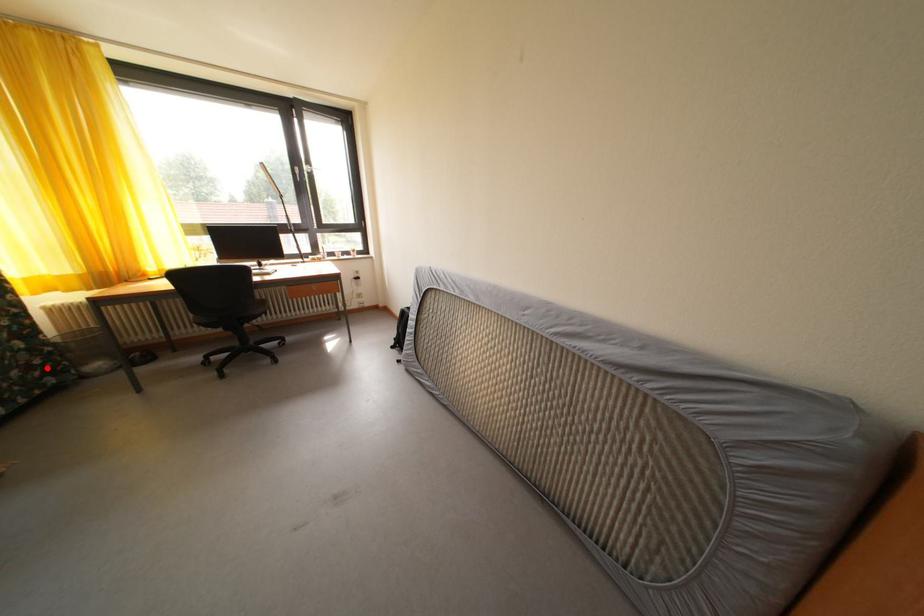
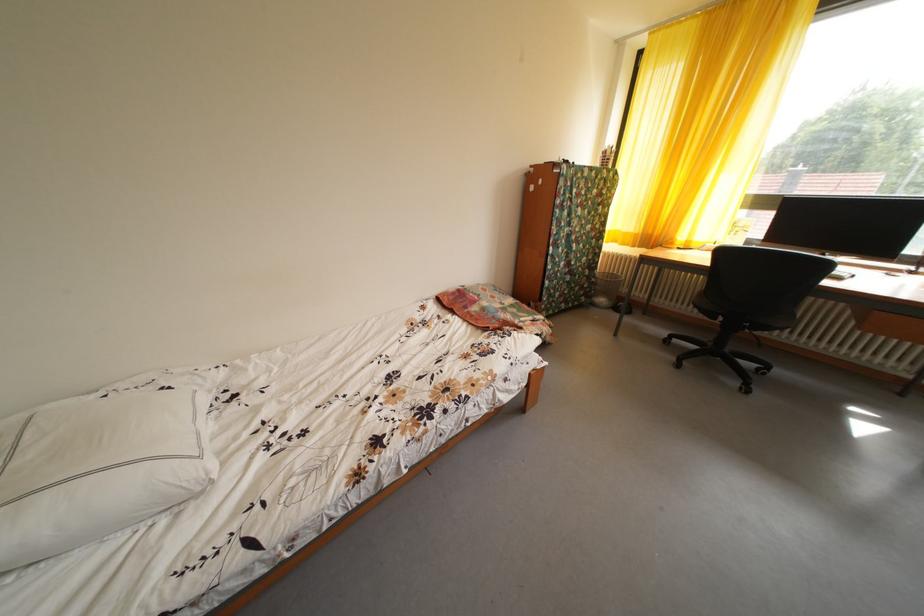
Question: I am providing you with two images of the same scene from different viewpoints. Image1 has a red point marked. In image2, the corresponding 3D location appears at what relative position? Reply with the corresponding letter.

Choices:
 (A) Closer
 (B) Farther

Answer: (A)